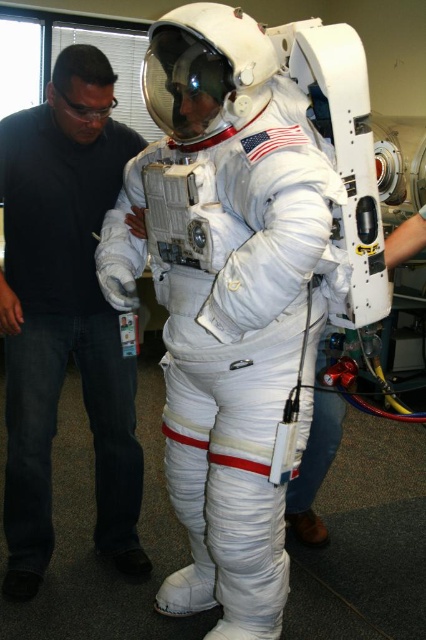
Question: Which object is closer to the camera taking this photo?

Choices:
 (A) clear plastic goggles at upper left
 (B) white matte astronaut suit at center

Answer: (A)

Question: Among these objects, which one is nearest to the camera?

Choices:
 (A) white fabric astronaut at center
 (B) clear plastic goggles at upper left
 (C) white matte astronaut suit at center

Answer: (A)

Question: Observing the image, what is the correct spatial positioning of white matte astronaut suit at center in reference to clear plastic goggles at upper left?

Choices:
 (A) left
 (B) right

Answer: (A)

Question: Does white fabric astronaut at center come behind white matte astronaut suit at center?

Choices:
 (A) no
 (B) yes

Answer: (A)

Question: Which of the following is the closest to the observer?

Choices:
 (A) (69, 100)
 (B) (97, 368)

Answer: (A)

Question: Can you confirm if white matte astronaut suit at center is positioned to the left of clear plastic goggles at upper left?

Choices:
 (A) no
 (B) yes

Answer: (B)